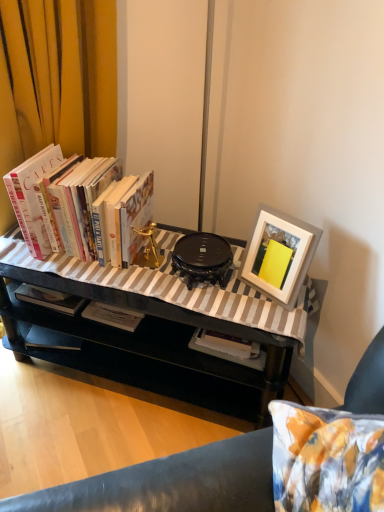
I want to click on white matte picture frame at upper right, so click(279, 255).

Describe the element at coordinates (138, 339) in the screenshot. I see `black glossy table at center` at that location.

Find the location of a particular element. white matte picture frame at upper right is located at coordinates (279, 255).

From the picture: Can you confirm if white matte picture frame at upper right is positioned to the right of hardcover books at left?

Indeed, white matte picture frame at upper right is positioned on the right side of hardcover books at left.

Is hardcover books at left at the back of white matte picture frame at upper right?

white matte picture frame at upper right is not turned away from hardcover books at left.

From a real-world perspective, is white matte picture frame at upper right physically below hardcover books at left?

Indeed, from a real-world perspective, white matte picture frame at upper right is positioned beneath hardcover books at left.

From a real-world perspective, who is located higher, hardcover books at left or white matte picture frame at upper right?

hardcover books at left, from a real-world perspective.

Considering the relative sizes of hardcover books at left and white matte picture frame at upper right in the image provided, is hardcover books at left bigger than white matte picture frame at upper right?

Yes.

Considering the positions of point (134, 229) and point (260, 264), is point (134, 229) closer or farther from the camera than point (260, 264)?

Point (134, 229) is positioned farther from the camera compared to point (260, 264).

Is hardcover books at left touching white matte picture frame at upper right?

No.

Does black glossy table at center touch hardcover books at left?

No, black glossy table at center is not next to hardcover books at left.

Between black glossy table at center and hardcover books at left, which one has smaller size?

With smaller size is hardcover books at left.

Is black glossy table at center aimed at hardcover books at left?

No, black glossy table at center is not turned towards hardcover books at left.

Is the position of black glossy table at center less distant than that of hardcover books at left?

Yes, the depth of black glossy table at center is less than that of hardcover books at left.

Which is more to the right, hardcover books at left or black glossy table at center?

black glossy table at center is more to the right.

Which object is further away from the camera taking this photo, hardcover books at left or black glossy table at center?

hardcover books at left.

Is hardcover books at left smaller than black glossy table at center?

Yes, hardcover books at left is smaller than black glossy table at center.

Between hardcover books at left and black glossy table at center, which one has more height?

Standing taller between the two is black glossy table at center.

Is black glossy table at center oriented towards white matte picture frame at upper right?

No, black glossy table at center is not facing towards white matte picture frame at upper right.

Which of these two, black glossy table at center or white matte picture frame at upper right, is bigger?

With larger size is black glossy table at center.

From the picture: Which is more to the right, black glossy table at center or white matte picture frame at upper right?

white matte picture frame at upper right.

From a real-world perspective, relative to white matte picture frame at upper right, is black glossy table at center vertically above or below?

black glossy table at center is below white matte picture frame at upper right.

Based on the photo, between white matte picture frame at upper right and black glossy table at center, which one appears on the left side from the viewer's perspective?

black glossy table at center is more to the left.

Is white matte picture frame at upper right facing towards black glossy table at center?

No.

Considering the positions of objects white matte picture frame at upper right and black glossy table at center in the image provided, who is in front, white matte picture frame at upper right or black glossy table at center?

black glossy table at center is in front.

Locate an element on the screen. book on the left side of white matte picture frame at upper right is located at coordinates (100, 211).

Where is `book lying behind the white matte picture frame at upper right`? book lying behind the white matte picture frame at upper right is located at coordinates [100, 211].

When comparing their distances from white matte picture frame at upper right, does hardcover books at left or black glossy table at center seem closer?

black glossy table at center is positioned closer to the anchor white matte picture frame at upper right.

Which object lies nearer to the anchor point black glossy table at center, hardcover books at left or white matte picture frame at upper right?

hardcover books at left lies closer to black glossy table at center than the other object.

Based on their spatial positions, is black glossy table at center or hardcover books at left further from white matte picture frame at upper right?

The object further to white matte picture frame at upper right is hardcover books at left.

In the scene shown: Looking at the image, which one is located further to hardcover books at left, white matte picture frame at upper right or black glossy table at center?

white matte picture frame at upper right is further to hardcover books at left.

Estimate the real-world distances between objects in this image. Which object is further from black glossy table at center, white matte picture frame at upper right or hardcover books at left?

white matte picture frame at upper right is positioned further to the anchor black glossy table at center.

Looking at the image, which one is located further to hardcover books at left, black glossy table at center or white matte picture frame at upper right?

white matte picture frame at upper right is further to hardcover books at left.

Locate an element on the screen. This screenshot has height=512, width=384. table situated between hardcover books at left and white matte picture frame at upper right from left to right is located at coordinates (138, 339).